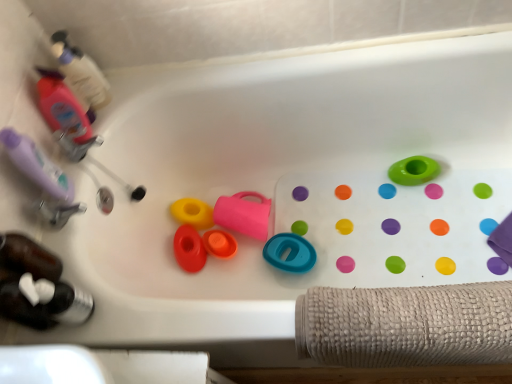
You are a GUI agent. You are given a task and a screenshot of the screen. Output one action in this format:
    pyautogui.click(x=<x>, y=<y>)
    Task: Click on the vacant space that is to the left of green rubber ring at upper right, which ranks as the 1th toy in right-to-left order
    
    Given the screenshot: What is the action you would take?
    pyautogui.click(x=360, y=205)